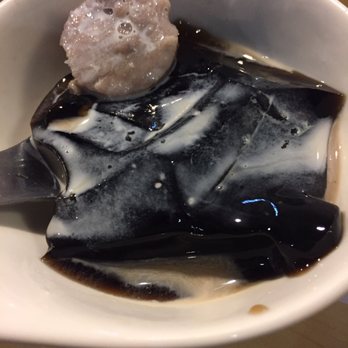
The height and width of the screenshot is (348, 348). I want to click on inside edge of white bowl, so click(28, 276).